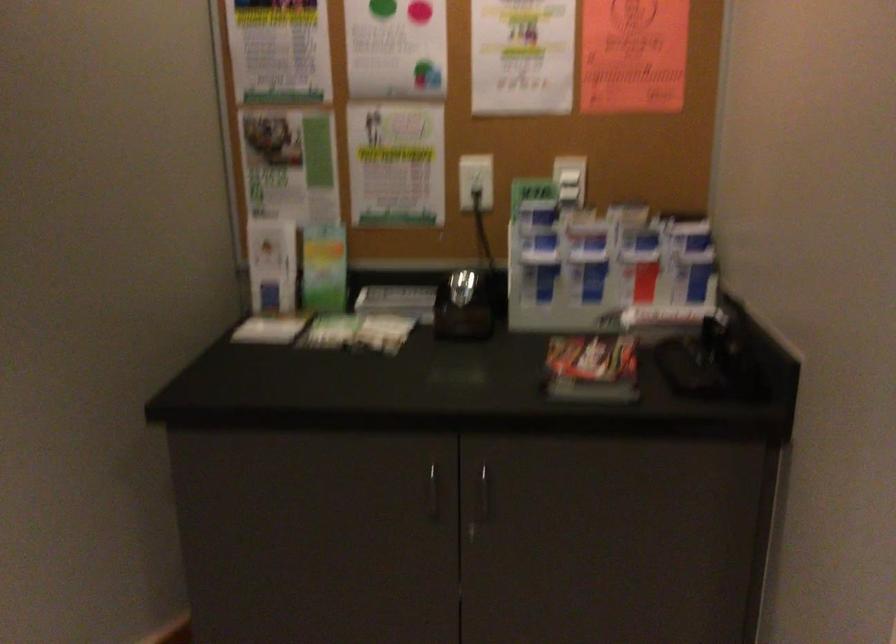
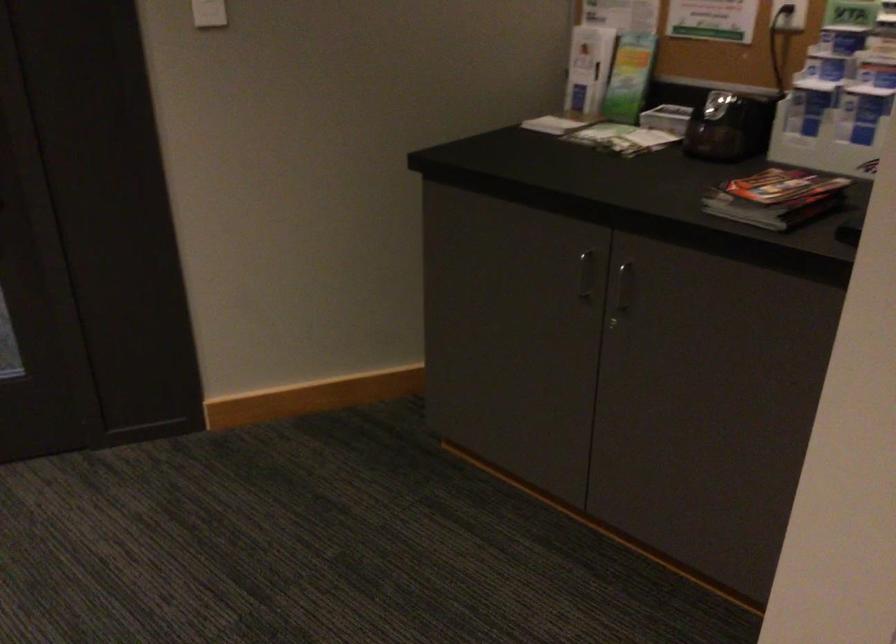
Locate, in the second image, the point that corresponds to pixel 424 489 in the first image.

(584, 275)